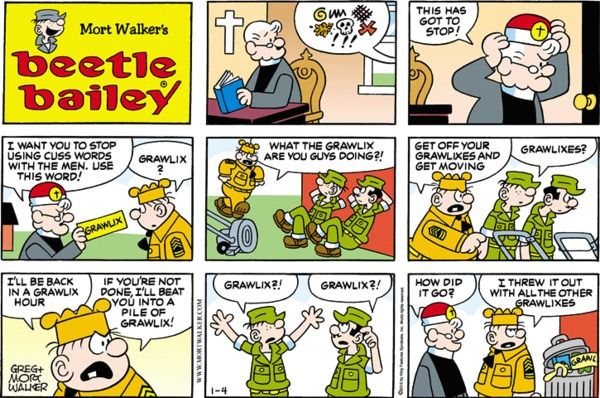
Identify the location of frames. (122, 97), (269, 77), (450, 78), (134, 196), (320, 202), (456, 200), (457, 322), (338, 320), (160, 314).